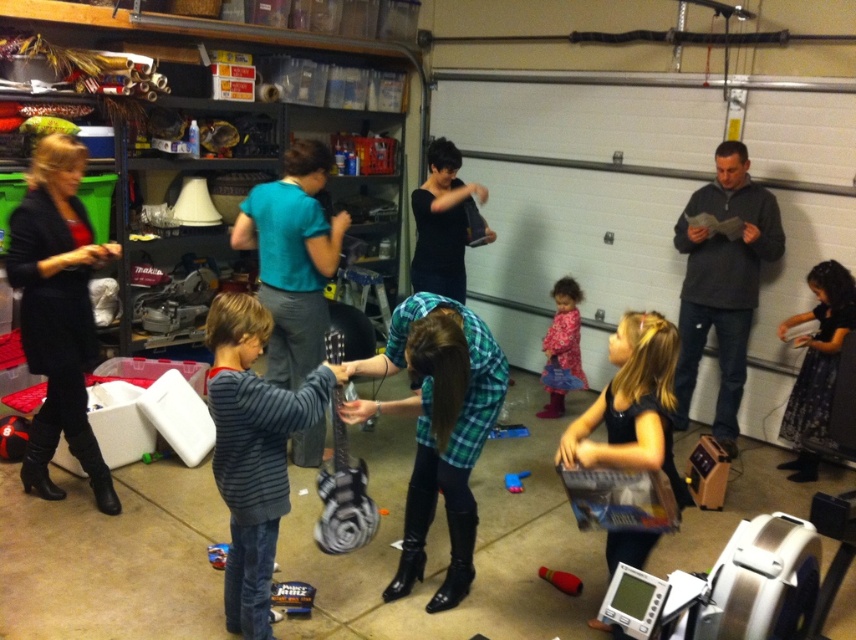
Question: Which point is closer to the camera?

Choices:
 (A) (566, 276)
 (B) (843, 301)
 (C) (424, 449)
 (D) (755, 257)

Answer: (C)

Question: Does dark gray sweater at right have a larger size compared to rubberized plastic toy at center?

Choices:
 (A) no
 (B) yes

Answer: (B)

Question: Does striped cotton shirt at center have a larger size compared to floral dress at center?

Choices:
 (A) no
 (B) yes

Answer: (B)

Question: Which point is closer to the camera?

Choices:
 (A) (673, 234)
 (B) (51, 385)

Answer: (B)

Question: Can you confirm if plaid fabric guitar at center is smaller than rubberized plastic toy at center?

Choices:
 (A) yes
 (B) no

Answer: (B)

Question: Which of these objects is positioned closest to the dark blue floral dress at right?

Choices:
 (A) black leather jacket at left
 (B) plaid fabric guitar at center
 (C) dark gray sweater at right

Answer: (C)